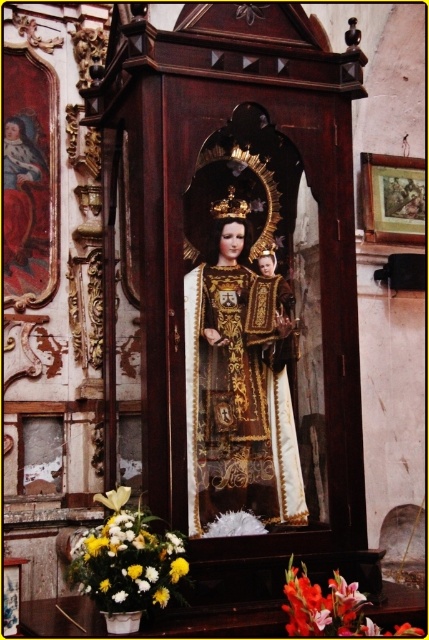
You are standing in front of the altar and need to place a small candle. The candle is too tall to fit between the white floral arrangement at lower left and the smooth orange gladiolus at lower center. Based on their positions, which object is closer to the left edge of the altar?

The white floral arrangement at lower left is closer to the left edge of the altar because it is positioned to the left of the smooth orange gladiolus at lower center.

You are a visitor standing in front of the religious altar. You notice the white floral arrangement at lower left and the yellow matte flower at lower left. Which one is closer to you?

The white floral arrangement at lower left is closer to you because it is in front of the yellow matte flower at lower left.

You are standing in front of the religious altar and want to place a small candle on the white floral arrangement at lower left. Can you reach it from your current position without moving closer?

The white floral arrangement at lower left is 30.03 meters away from the viewer, so you cannot reach it without moving closer.